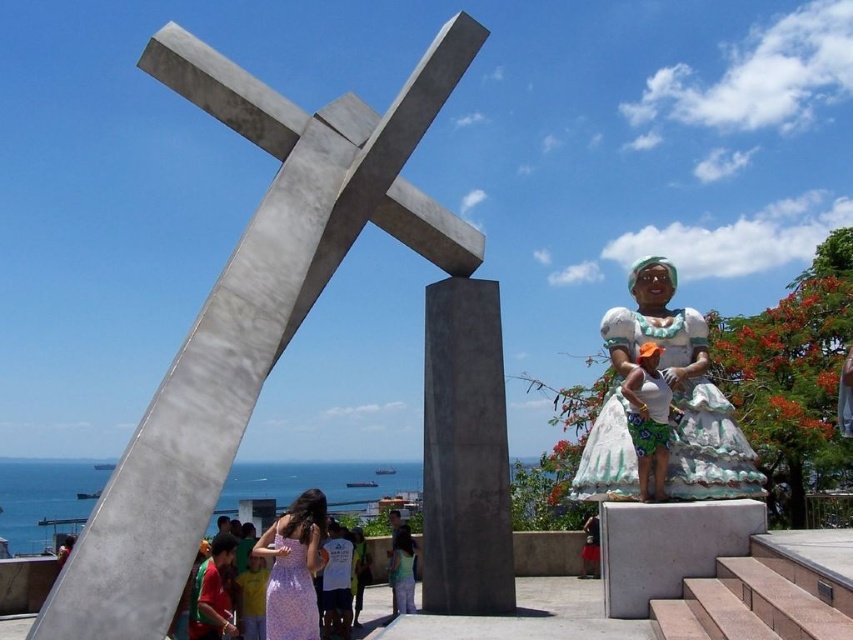
Where is `purple floral dress at center`? purple floral dress at center is located at coordinates (289, 582).

Does purple floral dress at center come in front of green floral skirt at right?

That is False.

This screenshot has height=640, width=853. Find the location of `purple floral dress at center`. purple floral dress at center is located at coordinates (289, 582).

Can you confirm if polished concrete cross at center is smaller than white fabric statue at right?

Incorrect, polished concrete cross at center is not smaller in size than white fabric statue at right.

Can you confirm if polished concrete cross at center is positioned below white fabric statue at right?

No.

Is point (177, 422) in front of point (738, 445)?

That is True.

Locate an element on the screen. polished concrete cross at center is located at coordinates (251, 312).

Is polished concrete cross at center taller than green floral skirt at right?

Yes, polished concrete cross at center is taller than green floral skirt at right.

Between point (242, 416) and point (660, 468), which one is positioned behind?

The point (242, 416) is more distant.

This screenshot has width=853, height=640. I want to click on polished concrete cross at center, so click(x=251, y=312).